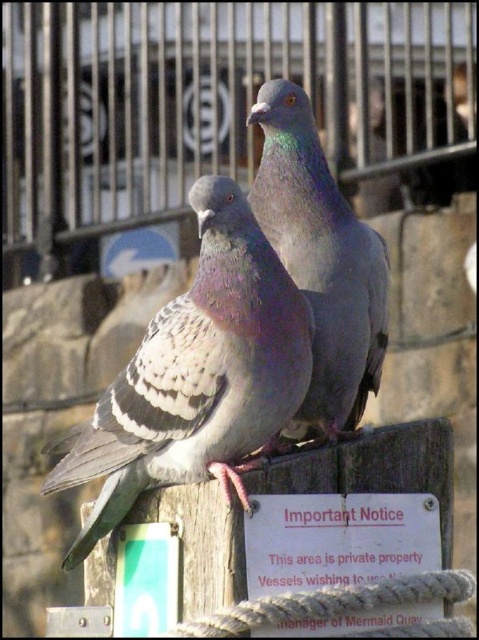
Question: Which object is closer to the camera taking this photo?

Choices:
 (A) gray feathered pigeon at center
 (B) speckled feathered pigeon at center

Answer: (B)

Question: Which point is closer to the camera?

Choices:
 (A) speckled feathered pigeon at center
 (B) gray matte pigeon at center

Answer: (A)

Question: Is brushed metal fence at upper center positioned at the back of speckled feathered pigeon at center?

Choices:
 (A) no
 (B) yes

Answer: (B)

Question: Does speckled feathered pigeon at center have a smaller size compared to gray matte pigeon at center?

Choices:
 (A) yes
 (B) no

Answer: (B)

Question: Estimate the real-world distances between objects in this image. Which object is farther from the gray matte pigeon at center?

Choices:
 (A) gray feathered pigeon at center
 (B) brushed metal fence at upper center
 (C) speckled feathered pigeon at center

Answer: (B)

Question: Does brushed metal fence at upper center lie in front of gray feathered pigeon at center?

Choices:
 (A) yes
 (B) no

Answer: (B)